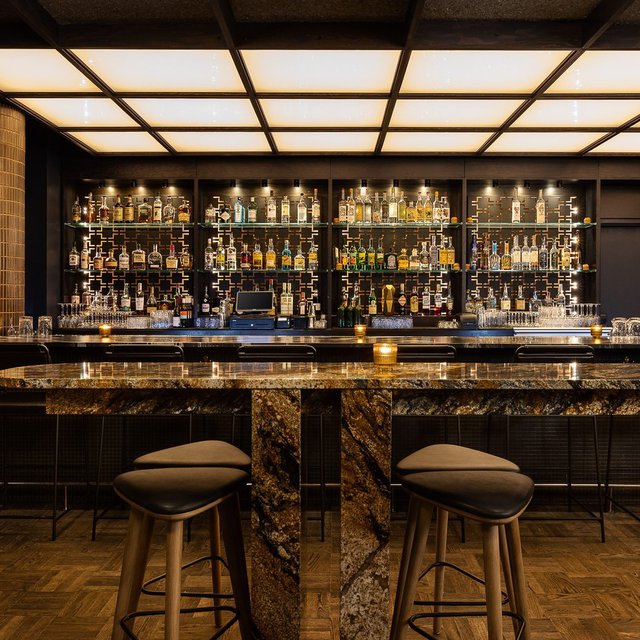
Locate an element on the screen. This screenshot has height=640, width=640. computer screen is located at coordinates (253, 301).